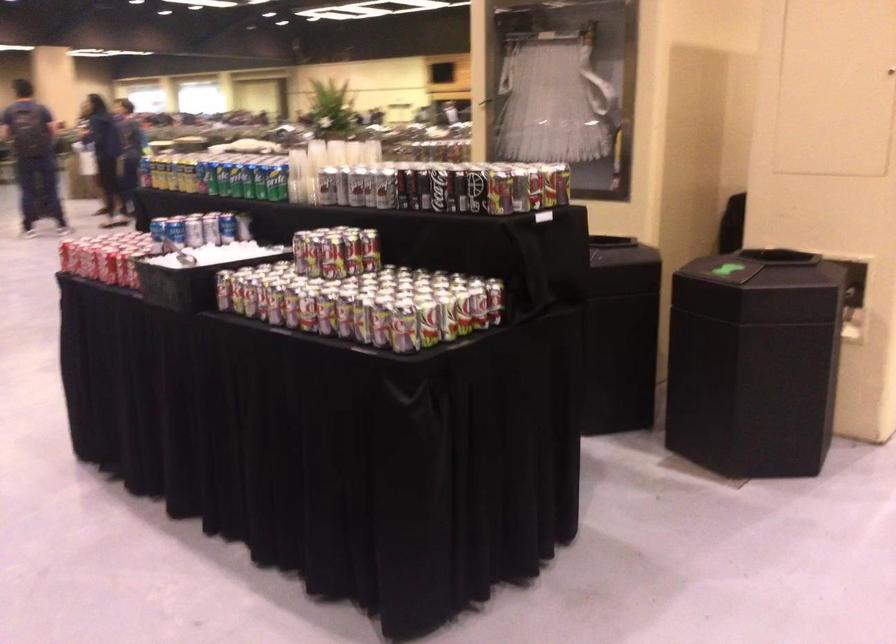
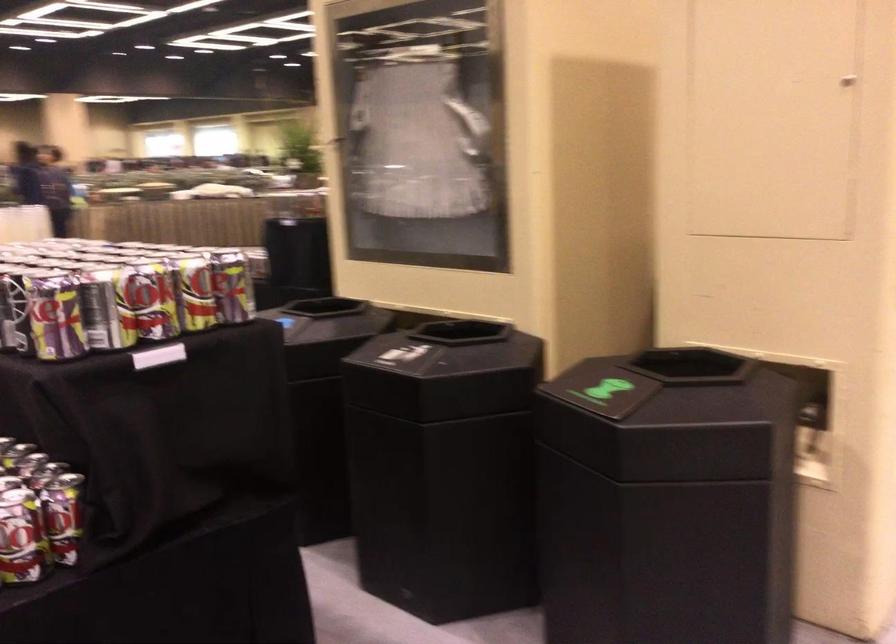
The point at (505, 181) is marked in the first image. Where is the corresponding point in the second image?

(55, 316)